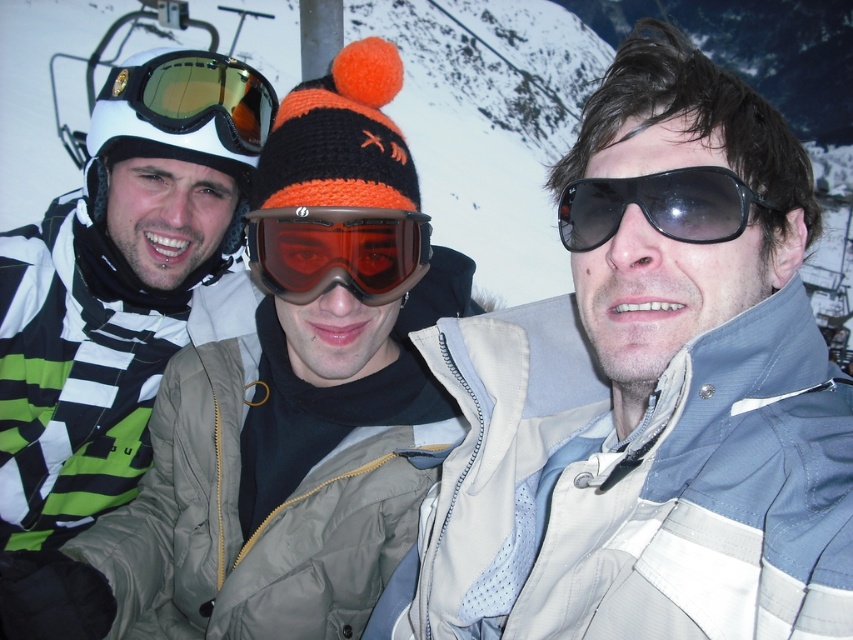
Measure the distance from translucent orange ski goggles at center to gold reflective lens goggles at upper left.

2.53 meters

Does translucent orange ski goggles at center lie behind gold reflective lens goggles at upper left?

That is False.

Is point (383, 221) closer to viewer compared to point (142, 88)?

Yes.

Identify the location of translucent orange ski goggles at center. Image resolution: width=853 pixels, height=640 pixels. (337, 252).

Who is more distant from viewer, (368, 252) or (590, 236)?

The point (368, 252) is behind.

Who is shorter, translucent orange ski goggles at center or black matte sunglasses at center?

Standing shorter between the two is black matte sunglasses at center.

Which is behind, point (392, 241) or point (701, 193)?

Positioned behind is point (392, 241).

Find the location of a particular element. translucent orange ski goggles at center is located at coordinates (337, 252).

Is point (247, 124) positioned after point (584, 248)?

Yes, point (247, 124) is farther from viewer.

The image size is (853, 640). Identify the location of gold reflective lens goggles at upper left. (196, 99).

This screenshot has height=640, width=853. I want to click on gold reflective lens goggles at upper left, so click(196, 99).